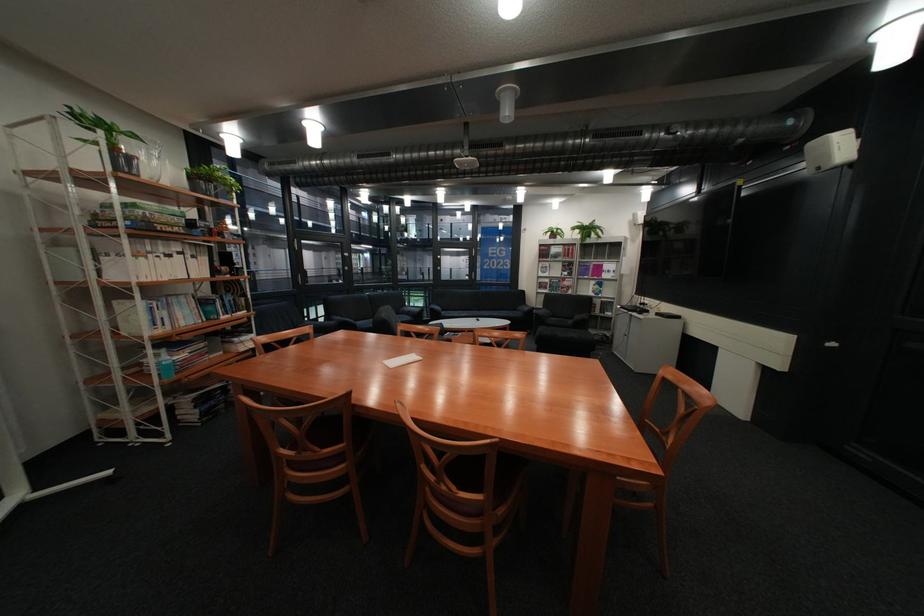
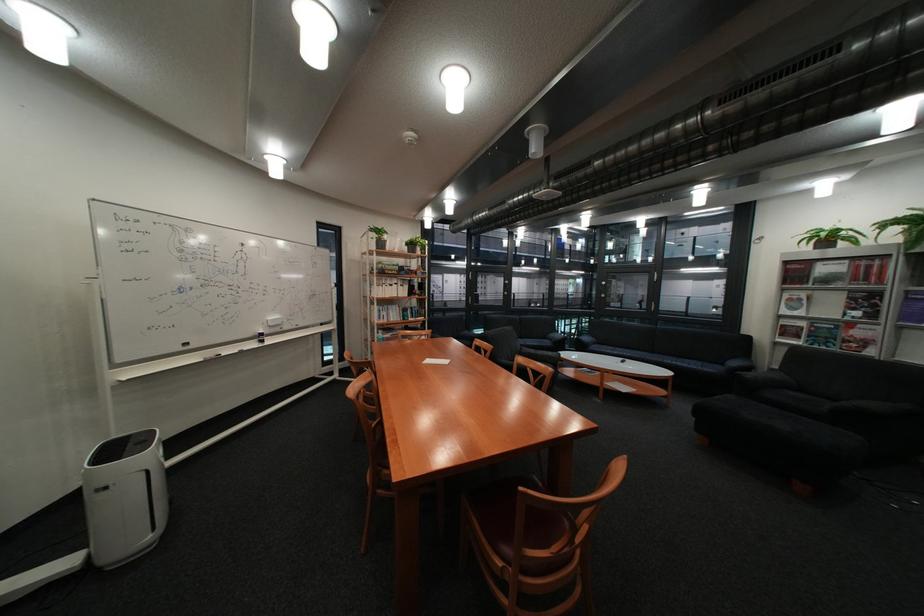
Locate, in the second image, the point that corresponds to point (79, 156) in the first image.

(383, 246)